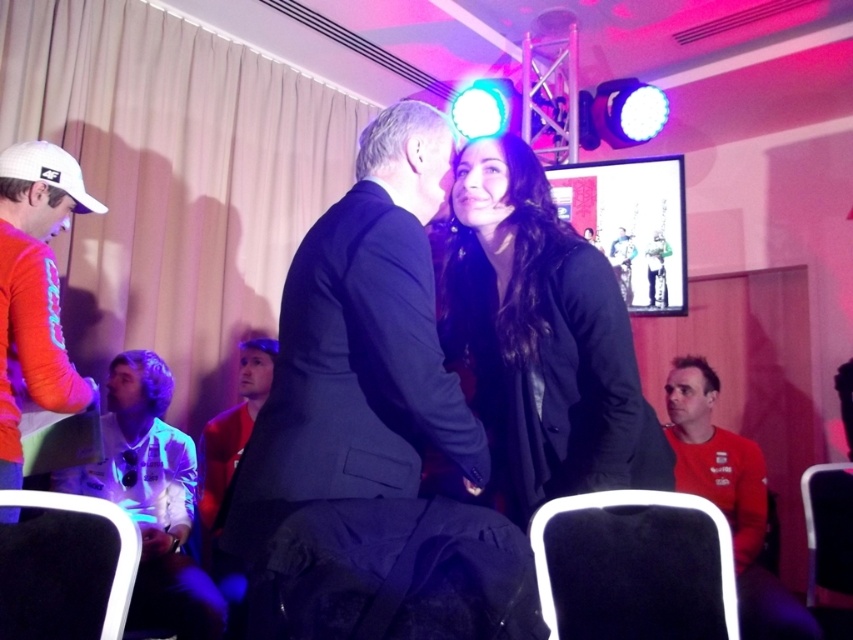
Does dark gray suit at center have a lesser height compared to red matte shirt at lower right?

No, dark gray suit at center is not shorter than red matte shirt at lower right.

This screenshot has width=853, height=640. Find the location of `dark gray suit at center`. dark gray suit at center is located at coordinates (372, 429).

Image resolution: width=853 pixels, height=640 pixels. In order to click on dark gray suit at center in this screenshot , I will do `click(372, 429)`.

Where is `dark gray suit at center`? This screenshot has height=640, width=853. dark gray suit at center is located at coordinates (372, 429).

In the scene shown: Is dark gray suit at center above orange fabric shirt at left?

No, dark gray suit at center is not above orange fabric shirt at left.

Which is more to the right, dark gray suit at center or orange fabric shirt at left?

dark gray suit at center is more to the right.

Where is `dark gray suit at center`? dark gray suit at center is located at coordinates (372, 429).

Is point (492, 461) closer to camera compared to point (178, 465)?

Yes, it is.

Looking at this image, which is above, black leather jacket at center or white glossy shirt at lower left?

black leather jacket at center is higher up.

Locate an element on the screen. black leather jacket at center is located at coordinates (541, 339).